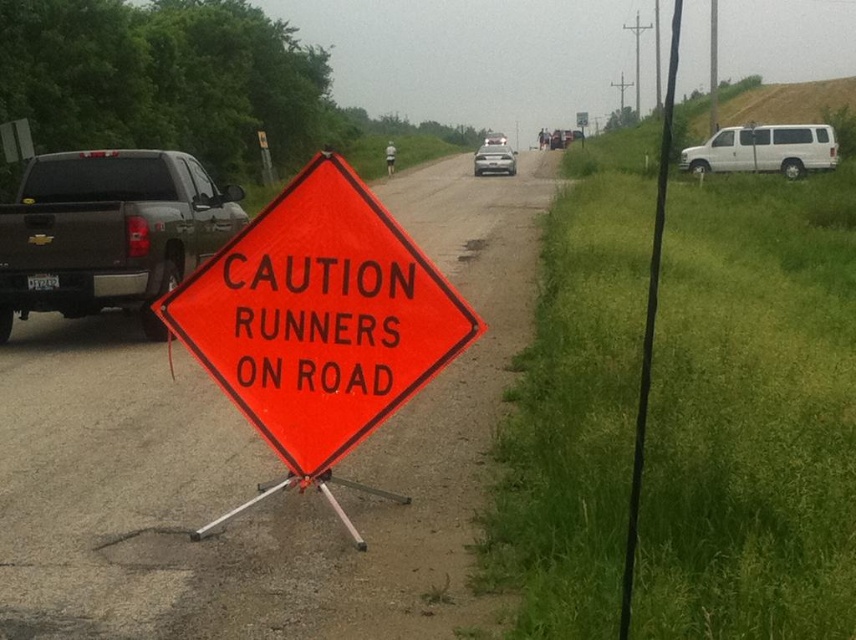
Based on the photo, you are a pedestrian standing at the point marked by coordinates point (x=108, y=232). You want to cross the road to reach the white van on the right side. Which direction should you walk to avoid the matte black truck at left?

The point (x=108, y=232) corresponds to the matte black truck at left, so you should walk towards the right side of the road away from the matte black truck at left to reach the white van on the right side.

You are a delivery person planning to load packages onto the matte black truck at left and the silver metallic sedan at center. Which vehicle should you choose if you need to stack packages higher?

The matte black truck at left has a greater height compared to the silver metallic sedan at center, so you should choose the matte black truck at left to stack packages higher.